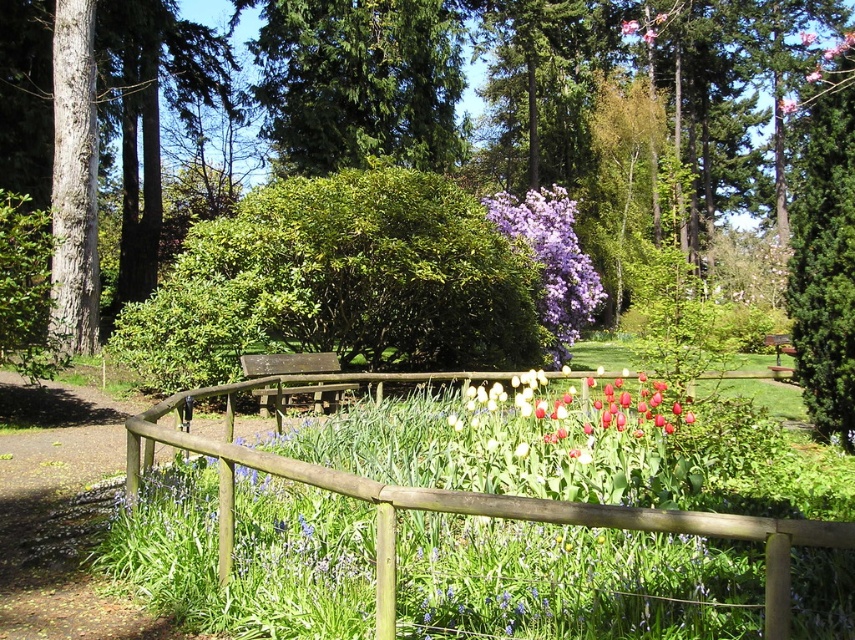
Does point (262, 388) come closer to viewer compared to point (782, 100)?

Yes, point (262, 388) is in front of point (782, 100).

Is wooden bench at center above purple matte flower at upper center?

No.

Is point (255, 396) closer to camera compared to point (782, 106)?

Yes, it is in front of point (782, 106).

At what (x,y) coordinates should I click in order to perform the action: click on wooden bench at center. Please return your answer as a coordinate pair (x, y). The image size is (855, 640). Looking at the image, I should click on (287, 364).

Where is `green leafy bush at center`? Image resolution: width=855 pixels, height=640 pixels. green leafy bush at center is located at coordinates (340, 284).

Can you confirm if green leafy bush at center is taller than lavender soft-textured flowers at center?

Incorrect, green leafy bush at center's height is not larger of lavender soft-textured flowers at center's.

Between point (310, 266) and point (532, 225), which one is positioned in front?

Point (310, 266) is more forward.

Locate an element on the screen. The image size is (855, 640). green leafy bush at center is located at coordinates (340, 284).

Is green textured tree at upper center smaller than wooden fence at center?

Indeed, green textured tree at upper center has a smaller size compared to wooden fence at center.

Which is below, green textured tree at upper center or wooden fence at center?

wooden fence at center is lower down.

Find the location of a particular element. green textured tree at upper center is located at coordinates (358, 81).

This screenshot has height=640, width=855. In order to click on green textured tree at upper center in this screenshot , I will do `click(358, 81)`.